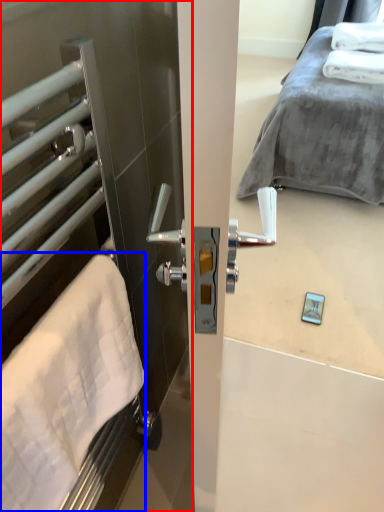
Question: Which point is further to the camera, screen door (highlighted by a red box) or bath towel (highlighted by a blue box)?

Choices:
 (A) screen door
 (B) bath towel

Answer: (B)